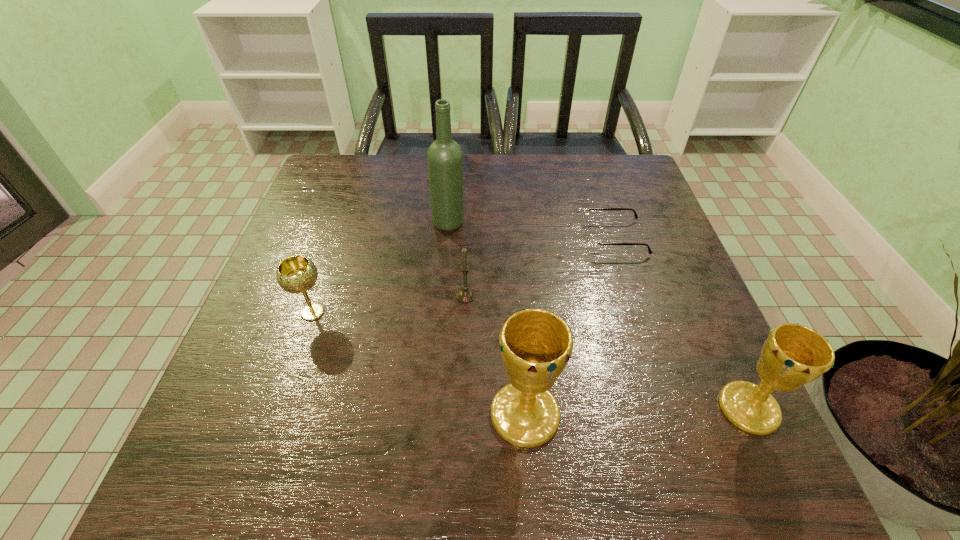
What are the coordinates of `blank space located 0.240m on the right of the fifth shortest object` in the screenshot? It's located at (699, 414).

Image resolution: width=960 pixels, height=540 pixels. Find the location of `free region located on the back of the rightmost object`. free region located on the back of the rightmost object is located at coordinates (672, 241).

At what (x,y) coordinates should I click in order to perform the action: click on free space located 0.360m on the front of the wine bottle. Please return your answer as a coordinate pair (x, y). Looking at the image, I should click on (439, 356).

What are the coordinates of `free region located at the hinge ends of the fifth object from left to right` in the screenshot? It's located at (441, 238).

Find the location of a particular element. The image size is (960, 540). free space located 0.250m at the hinge ends of the fifth object from left to right is located at coordinates (486, 238).

Where is `free space located at the hinge ends of the fifth object from left to right`? The width and height of the screenshot is (960, 540). free space located at the hinge ends of the fifth object from left to right is located at coordinates (555, 238).

This screenshot has height=540, width=960. Find the location of `vacant space located on the back of the shortest chalice`. vacant space located on the back of the shortest chalice is located at coordinates (346, 215).

Where is `vacant area located on the right of the candle`? This screenshot has width=960, height=540. vacant area located on the right of the candle is located at coordinates (638, 295).

Where is `object positioned at the left edge`? This screenshot has height=540, width=960. object positioned at the left edge is located at coordinates (296, 274).

The height and width of the screenshot is (540, 960). Identify the location of chalice situated at the right edge. (793, 355).